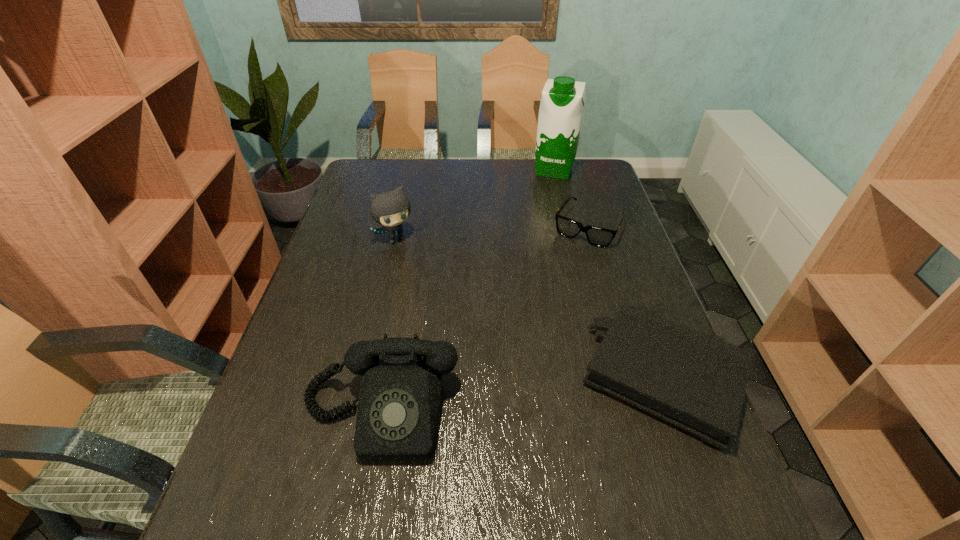
At what (x,y) coordinates should I click in order to perform the action: click on free space located on the front-facing side of the farthest object. Please return your answer as a coordinate pair (x, y). This screenshot has height=540, width=960. Looking at the image, I should click on (538, 227).

This screenshot has height=540, width=960. I want to click on free region located 0.280m on the front-facing side of the farthest object, so click(x=538, y=225).

Locate an element on the screen. This screenshot has width=960, height=540. vacant point located on the front-facing side of the farthest object is located at coordinates (x=544, y=205).

This screenshot has width=960, height=540. What are the coordinates of `free space located 0.260m on the front-facing side of the kitten` in the screenshot? It's located at (444, 304).

This screenshot has height=540, width=960. What are the coordinates of `vacant space situated on the front-facing side of the kitten` in the screenshot? It's located at pos(448,312).

This screenshot has width=960, height=540. I want to click on free space located 0.070m on the front-facing side of the kitten, so pos(417,262).

I want to click on object that is at the far edge, so click(562, 102).

The height and width of the screenshot is (540, 960). I want to click on telephone that is at the near edge, so click(400, 397).

You are a GUI agent. You are given a task and a screenshot of the screen. Output one action in this format:
    pyautogui.click(x=<x>, y=<y>)
    Task: Click on the Bible present at the near edge
    The height and width of the screenshot is (540, 960).
    Given the screenshot: What is the action you would take?
    pyautogui.click(x=697, y=382)

Locate an element on the screen. This screenshot has height=540, width=960. telephone situated at the left edge is located at coordinates (400, 397).